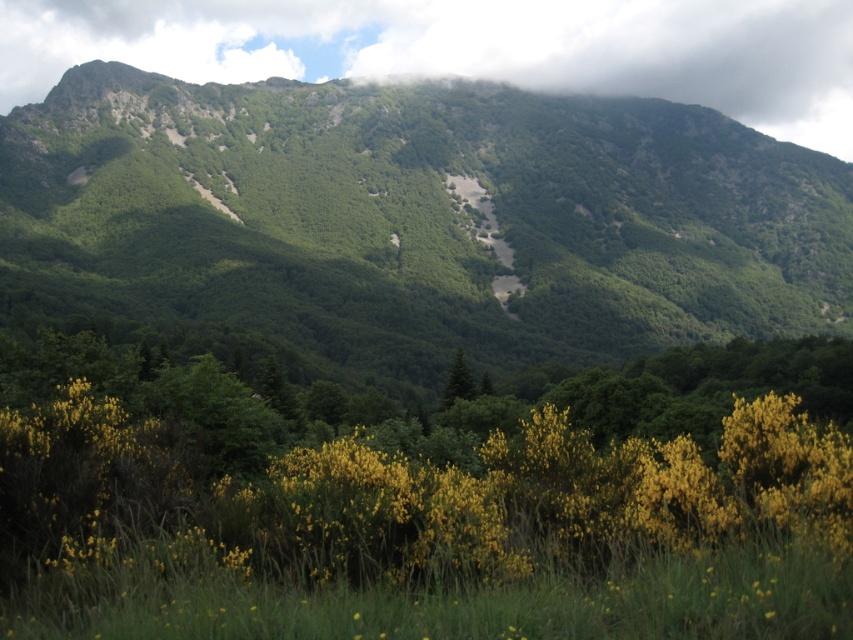
Is white fluffy cloud at upper center positioned before green matte tree at center?

No, it is behind green matte tree at center.

Is point (759, 74) in front of point (456, 349)?

No, (759, 74) is further to viewer.

Locate an element on the screen. The image size is (853, 640). white fluffy cloud at upper center is located at coordinates (637, 54).

Is green leafy mountain at center wider than white fluffy cloud at upper center?

Yes, green leafy mountain at center is wider than white fluffy cloud at upper center.

Is green leafy mountain at center further to camera compared to white fluffy cloud at upper center?

No, it is not.

Find the location of a particular element. This screenshot has height=640, width=853. green leafy mountain at center is located at coordinates tap(410, 221).

Looking at this image, can you confirm if green leafy mountain at center is bigger than green matte tree at center?

Correct, green leafy mountain at center is larger in size than green matte tree at center.

In the scene shown: Does green leafy mountain at center have a lesser width compared to green matte tree at center?

Incorrect, green leafy mountain at center's width is not less than green matte tree at center's.

Does point (306, 346) lie behind point (462, 355)?

Yes.

Locate an element on the screen. This screenshot has height=640, width=853. green leafy mountain at center is located at coordinates (410, 221).